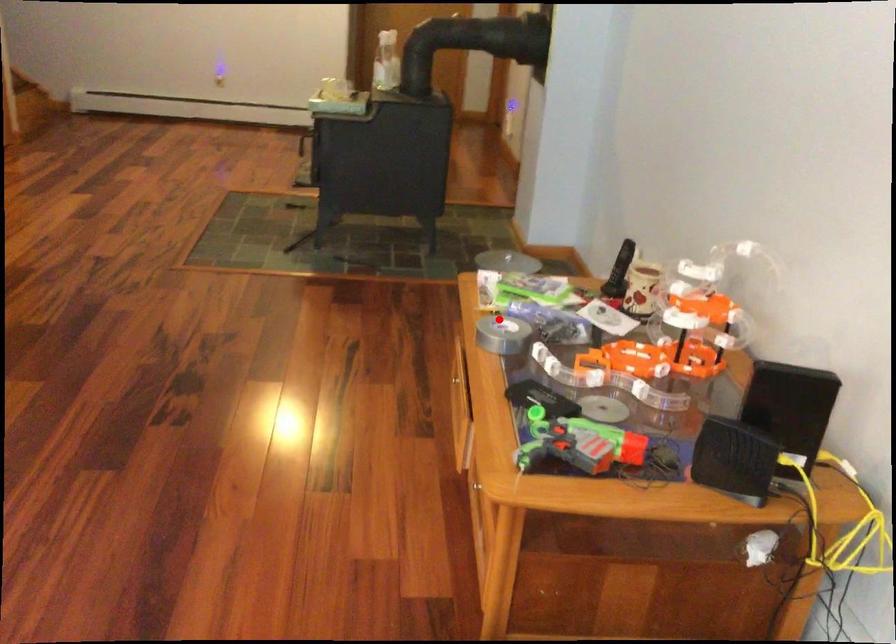
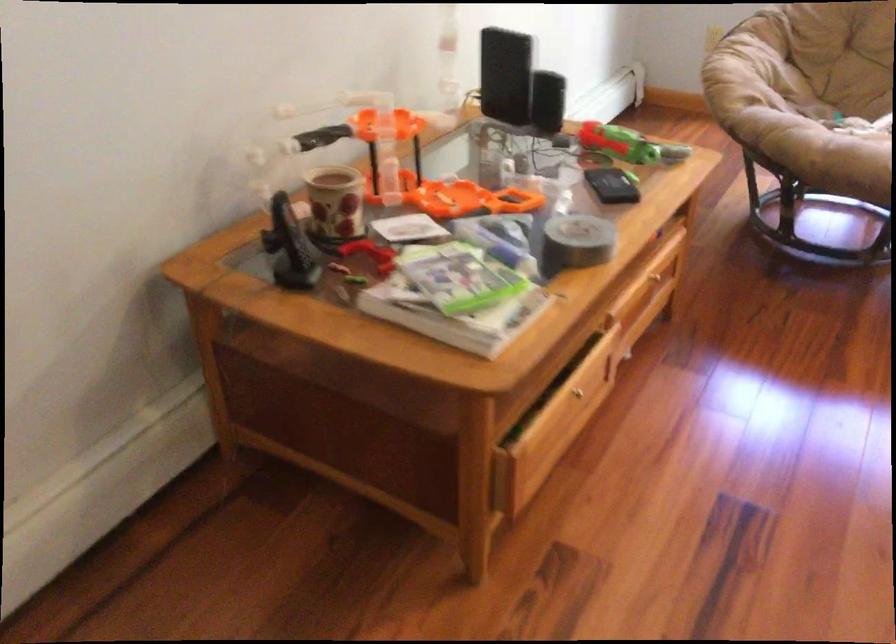
Find the pixel in the second image that matches the highlighted location in the first image.

(576, 242)